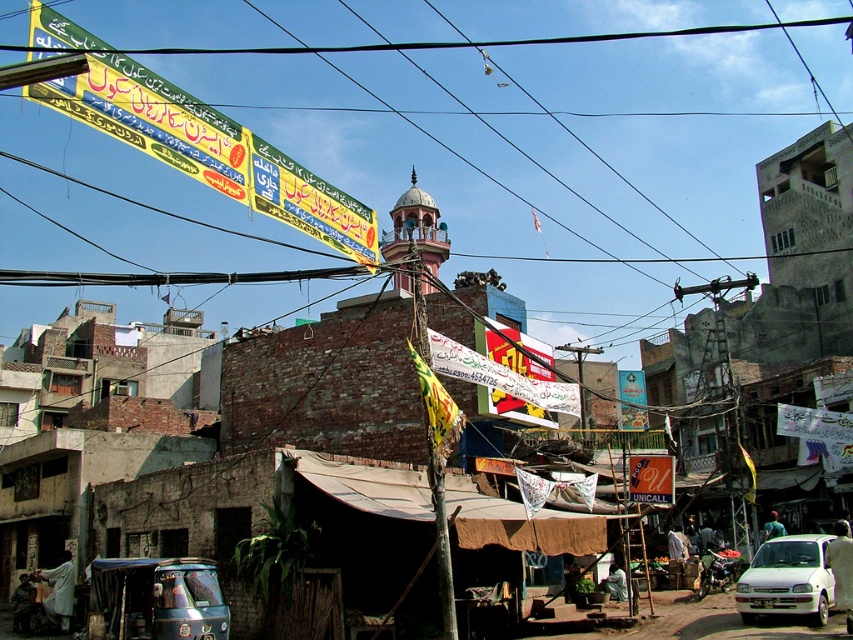
Question: Estimate the real-world distances between objects in this image. Which object is closer to the metallic green auto-rickshaw at lower left?

Choices:
 (A) white matte car at lower right
 (B) pink marble minaret at center

Answer: (A)

Question: Which object is the closest to the white matte car at lower right?

Choices:
 (A) pink marble minaret at center
 (B) metallic green auto-rickshaw at lower left

Answer: (B)

Question: Does metallic green auto-rickshaw at lower left appear over pink marble minaret at center?

Choices:
 (A) no
 (B) yes

Answer: (A)

Question: Does white matte car at lower right appear on the left side of pink marble minaret at center?

Choices:
 (A) no
 (B) yes

Answer: (A)

Question: Based on their relative distances, which object is farther from the white matte car at lower right?

Choices:
 (A) pink marble minaret at center
 (B) metallic green auto-rickshaw at lower left

Answer: (A)

Question: Does metallic green auto-rickshaw at lower left appear on the right side of white matte car at lower right?

Choices:
 (A) yes
 (B) no

Answer: (B)